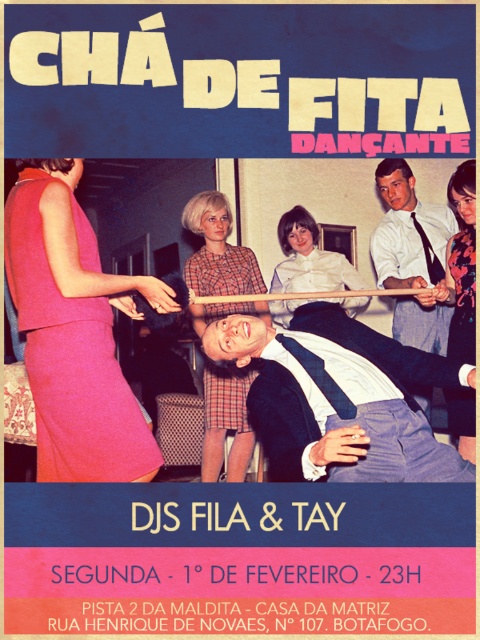
You are designing a costume for a dance performance and need to arrange the plaid fabric skirt at center and the white satin blouse at center from top to bottom. Which item should be placed first?

The white satin blouse at center should be placed first at the top since the plaid fabric skirt at center is located below it.

You are designing a layout for a magazine spread and need to place an advertisement for the event. The ad must include both the matte pink dress at left and the dark blue suit at center. According to the original poster, which object should be placed on the left side of the other?

The matte pink dress at left should be placed on the left side of the dark blue suit at center, as it is positioned on the left side of the dark blue suit at center in the original poster.

You are standing 5 feet away from the poster. Can you see the matte pink dress at left clearly?

The matte pink dress at left is 6.24 feet away from the viewer, so since you are standing 5 feet away, you are closer than that distance. Therefore, you can see the matte pink dress at left clearly.